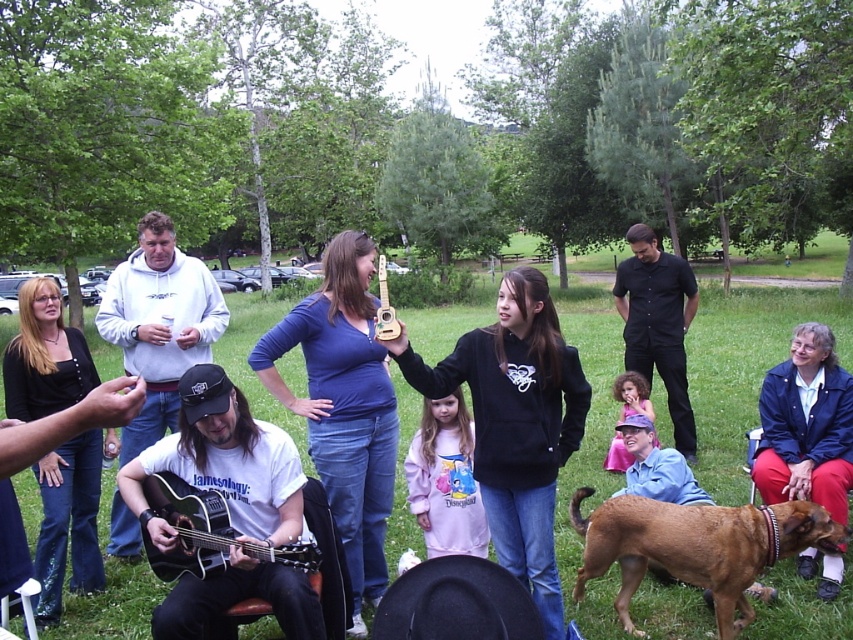
Question: Where is blue denim jacket at lower right located in relation to acoustic guitar at lower left in the image?

Choices:
 (A) below
 (B) above

Answer: (B)

Question: Does white matte hoodie at center come behind black smooth shirt at center?

Choices:
 (A) no
 (B) yes

Answer: (A)

Question: Estimate the real-world distances between objects in this image. Which object is closer to the black smooth shirt at center?

Choices:
 (A) acoustic guitar at lower left
 (B) blue denim jacket at lower right

Answer: (B)

Question: Which object is farther from the camera taking this photo?

Choices:
 (A) wooden acoustic guitar at center
 (B) acoustic guitar at lower left
 (C) brown fur dog at lower right
 (D) green grass at center

Answer: (D)

Question: Which point appears closest to the camera in this image?

Choices:
 (A) (616, 595)
 (B) (306, 541)
 (C) (672, 426)

Answer: (B)

Question: Is black matte guitar at center positioned at the back of blue denim jacket at lower right?

Choices:
 (A) no
 (B) yes

Answer: (A)